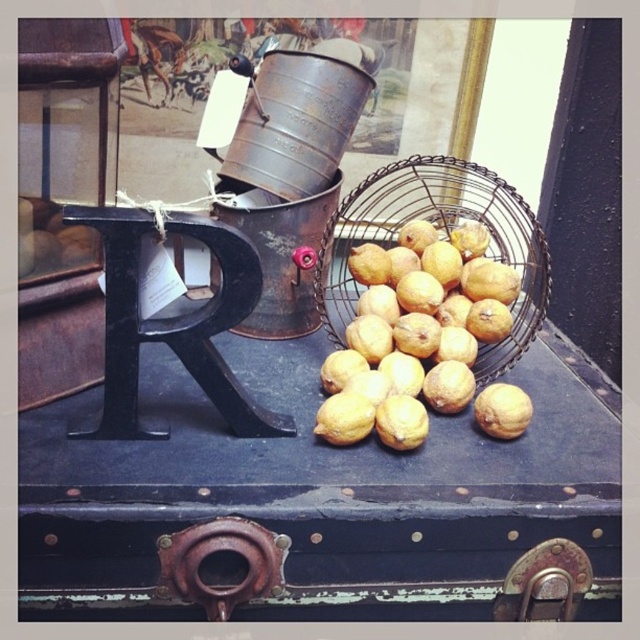
Question: Which object is closer to the camera taking this photo?

Choices:
 (A) rusty metal trunk at center
 (B) yellow matte lemon at center

Answer: (A)

Question: Does rusty metal trunk at center appear on the left side of yellow matte lemon at center?

Choices:
 (A) yes
 (B) no

Answer: (A)

Question: Is rusty metal trunk at center above metallic wire basket at center?

Choices:
 (A) no
 (B) yes

Answer: (A)

Question: Can you confirm if rusty metal trunk at center is thinner than yellow matte lemon at center?

Choices:
 (A) yes
 (B) no

Answer: (B)

Question: Estimate the real-world distances between objects in this image. Which object is closer to the metallic wire basket at center?

Choices:
 (A) yellow matte lemon at center
 (B) rusty metal trunk at center

Answer: (B)

Question: Among these points, which one is farthest from the camera?

Choices:
 (A) (509, 307)
 (B) (612, 486)
 (C) (492, 385)

Answer: (A)